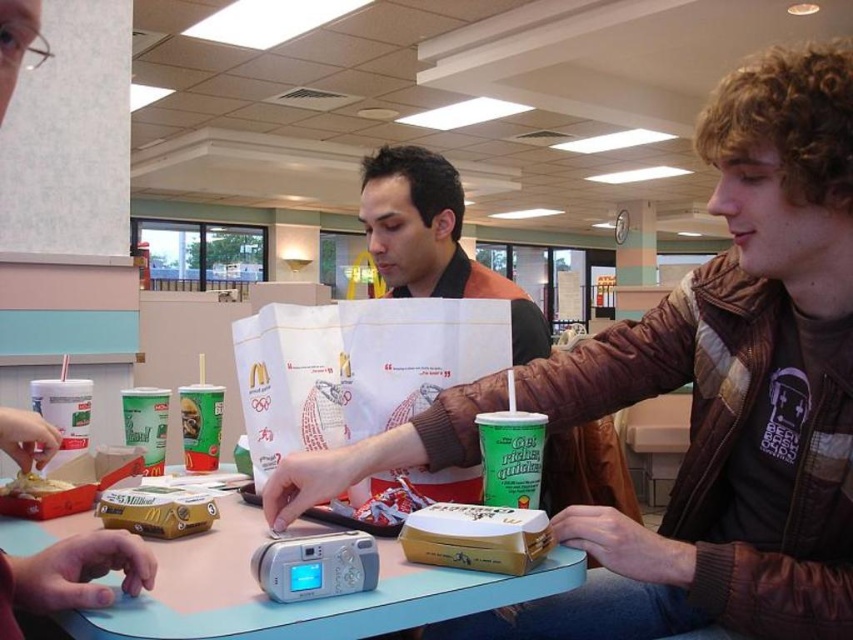
Does matte black camera at center appear under printed paper bag at center?

No.

What do you see at coordinates (71, 576) in the screenshot? The image size is (853, 640). I see `matte black camera at center` at bounding box center [71, 576].

Between point (123, 534) and point (422, 499), which one is positioned in front?

Point (123, 534) is more forward.

At what (x,y) coordinates should I click in order to perform the action: click on matte black camera at center. Please return your answer as a coordinate pair (x, y). Looking at the image, I should click on (71, 576).

Is metallic silver camera at center to the left of matte black camera at center from the viewer's perspective?

In fact, metallic silver camera at center is to the right of matte black camera at center.

Can you confirm if metallic silver camera at center is positioned above matte black camera at center?

Actually, metallic silver camera at center is below matte black camera at center.

At what (x,y) coordinates should I click in order to perform the action: click on metallic silver camera at center. Please return your answer as a coordinate pair (x, y). This screenshot has width=853, height=640. Looking at the image, I should click on (302, 602).

Does point (16, 413) lie behind point (33, 476)?

No, (16, 413) is in front of (33, 476).

Is matte black camera at center closer to camera compared to golden crispy chicken at center?

Yes, it is.

Which is behind, point (39, 56) or point (55, 488)?

The point (39, 56) is more distant.

Find the location of a particular element. This screenshot has width=853, height=640. matte black camera at center is located at coordinates (71, 576).